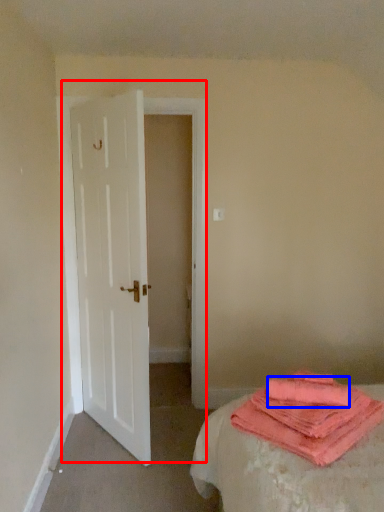
Question: Among these objects, which one is farthest to the camera, door (highlighted by a red box) or beach towel (highlighted by a blue box)?

Choices:
 (A) door
 (B) beach towel

Answer: (A)